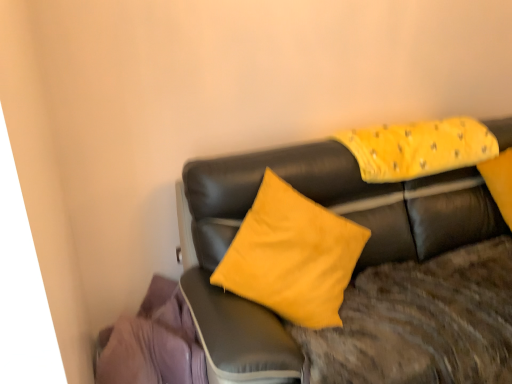
In order to face matte black couch at center, should I rotate leftwards or rightwards?

To face it directly, rotate right by 22.929 degrees.

You are a GUI agent. You are given a task and a screenshot of the screen. Output one action in this format:
    pyautogui.click(x=<x>, y=<y>)
    Task: Click on the purple fabric at lower left
    The width and height of the screenshot is (512, 384).
    Given the screenshot: What is the action you would take?
    pyautogui.click(x=152, y=342)

You are a GUI agent. You are given a task and a screenshot of the screen. Output one action in this format:
    pyautogui.click(x=<x>, y=<y>)
    Task: Click on the yellow fabric pillow at upper right
    
    Given the screenshot: What is the action you would take?
    pyautogui.click(x=419, y=148)

In the image, is purple fabric at lower left on the left side or the right side of matte black couch at center?

In the image, purple fabric at lower left appears on the left side of matte black couch at center.

Considering the positions of objects purple fabric at lower left and matte black couch at center in the image provided, who is in front, purple fabric at lower left or matte black couch at center?

matte black couch at center.

Is purple fabric at lower left turned away from matte black couch at center?

No, purple fabric at lower left is not facing away from matte black couch at center.

Considering the relative positions of yellow fabric pillow at upper right and purple fabric at lower left in the image provided, is yellow fabric pillow at upper right to the left or to the right of purple fabric at lower left?

Based on their positions, yellow fabric pillow at upper right is located to the right of purple fabric at lower left.

Is yellow fabric pillow at upper right bigger than purple fabric at lower left?

Actually, yellow fabric pillow at upper right might be smaller than purple fabric at lower left.

Is yellow fabric pillow at upper right further to camera compared to purple fabric at lower left?

Yes, yellow fabric pillow at upper right is further from the camera.

In terms of width, does yellow fabric pillow at upper right look wider or thinner when compared to purple fabric at lower left?

Clearly, yellow fabric pillow at upper right has less width compared to purple fabric at lower left.

Image resolution: width=512 pixels, height=384 pixels. What are the coordinates of `pillow above the matte black couch at center (from the image's perspective)` in the screenshot? It's located at tap(419, 148).

Is yellow fabric pillow at upper right in front of or behind matte black couch at center in the image?

A: In the image, yellow fabric pillow at upper right appears behind matte black couch at center.

In the scene shown: Between yellow fabric pillow at upper right and matte black couch at center, which one has larger size?

matte black couch at center is bigger.

Consider the image. From the image's perspective, is yellow fabric pillow at upper right located above or below matte black couch at center?

Based on their image positions, yellow fabric pillow at upper right is located above matte black couch at center.

Considering the positions of point (182, 214) and point (193, 382), is point (182, 214) closer or farther from the camera than point (193, 382)?

Clearly, point (182, 214) is more distant from the camera than point (193, 382).

In terms of width, does matte black couch at center look wider or thinner when compared to purple fabric at lower left?

A: Clearly, matte black couch at center has more width compared to purple fabric at lower left.

Does matte black couch at center turn towards purple fabric at lower left?

No.

Find the location of a particular element. The width and height of the screenshot is (512, 384). material located behind the matte black couch at center is located at coordinates (152, 342).

Considering the positions of points (357, 199) and (370, 130), is point (357, 199) closer to camera compared to point (370, 130)?

Yes, point (357, 199) is in front of point (370, 130).

Locate an element on the screen. The width and height of the screenshot is (512, 384). studio couch below the yellow fabric pillow at upper right (from a real-world perspective) is located at coordinates (329, 209).

Would you consider matte black couch at center to be distant from yellow fabric pillow at upper right?

No, matte black couch at center is in close proximity to yellow fabric pillow at upper right.

Is matte black couch at center taller than yellow fabric pillow at upper right?

Yes.

From the image's perspective, which object appears higher, purple fabric at lower left or yellow fabric pillow at upper right?

yellow fabric pillow at upper right appears higher in the image.

You are a GUI agent. You are given a task and a screenshot of the screen. Output one action in this format:
    pyautogui.click(x=<x>, y=<y>)
    Task: Click on the pillow above the purple fabric at lower left (from the image's perspective)
    
    Given the screenshot: What is the action you would take?
    pos(419,148)

Locate an element on the screen. material on the left of matte black couch at center is located at coordinates (152, 342).

Identify the location of material directly beneath the yellow fabric pillow at upper right (from a real-world perspective). Image resolution: width=512 pixels, height=384 pixels. (152, 342).

Looking at the image, which one is located closer to purple fabric at lower left, matte black couch at center or yellow fabric pillow at upper right?

matte black couch at center is positioned closer to the anchor purple fabric at lower left.

Estimate the real-world distances between objects in this image. Which object is further from purple fabric at lower left, yellow fabric pillow at upper right or matte black couch at center?

Based on the image, yellow fabric pillow at upper right appears to be further to purple fabric at lower left.

Which object lies further to the anchor point matte black couch at center, yellow fabric pillow at upper right or purple fabric at lower left?

purple fabric at lower left.

When comparing their distances from yellow fabric pillow at upper right, does matte black couch at center or purple fabric at lower left seem further?

purple fabric at lower left is further to yellow fabric pillow at upper right.

In the scene shown: When comparing their distances from matte black couch at center, does purple fabric at lower left or yellow fabric pillow at upper right seem closer?

yellow fabric pillow at upper right lies closer to matte black couch at center than the other object.

When comparing their distances from yellow fabric pillow at upper right, does purple fabric at lower left or matte black couch at center seem further?

purple fabric at lower left lies further to yellow fabric pillow at upper right than the other object.

The height and width of the screenshot is (384, 512). Identify the location of pillow situated between purple fabric at lower left and matte black couch at center from left to right. (419, 148).